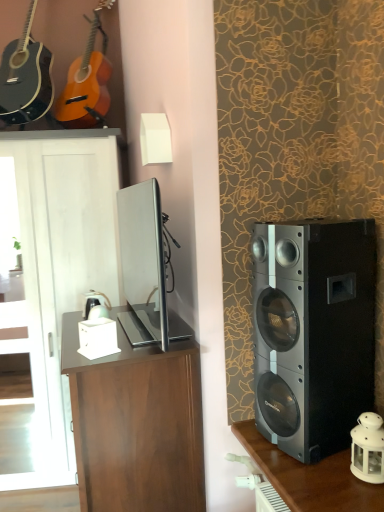
Describe the element at coordinates (145, 268) in the screenshot. The width and height of the screenshot is (384, 512). I see `satin silver tv at center` at that location.

The image size is (384, 512). What do you see at coordinates (136, 424) in the screenshot? I see `brown wood desk at center` at bounding box center [136, 424].

Consider the image. What is the approximate height of white glass lantern at lower right?

The height of white glass lantern at lower right is 8.22 inches.

Locate an element on the screen. dark wood shelf at right is located at coordinates (310, 477).

Can you confirm if white matte lampshade at upper center is positioned to the left of matte wood guitar at upper left, arranged as the first guitar when viewed from the right?

No, white matte lampshade at upper center is not to the left of matte wood guitar at upper left, arranged as the first guitar when viewed from the right.

In the scene shown: Which object is further away from the camera taking this photo, white matte lampshade at upper center or matte wood guitar at upper left, which appears as the 2th guitar when viewed from the left?

matte wood guitar at upper left, which appears as the 2th guitar when viewed from the left.

Consider the image. From the image's perspective, which one is positioned higher, satin silver tv at center or matte wood guitar at upper left, which appears as the 2th guitar when viewed from the left?

matte wood guitar at upper left, which appears as the 2th guitar when viewed from the left, appears higher in the image.

Based on the photo, between satin silver tv at center and matte wood guitar at upper left, arranged as the first guitar when viewed from the right, which one has smaller width?

satin silver tv at center is thinner.

What's the angular difference between satin silver tv at center and matte wood guitar at upper left, which appears as the 2th guitar when viewed from the left,'s facing directions?

The facing directions of satin silver tv at center and matte wood guitar at upper left, which appears as the 2th guitar when viewed from the left, are 79.6 degrees apart.

This screenshot has width=384, height=512. Find the location of `television below the matte wood guitar at upper left, arranged as the first guitar when viewed from the right (from the image's perspective)`. television below the matte wood guitar at upper left, arranged as the first guitar when viewed from the right (from the image's perspective) is located at coordinates (145, 268).

From the image's perspective, is brown wood desk at center over matte black acoustic guitar at upper left, the first guitar when ordered from left to right?

No, from the image's perspective, brown wood desk at center is not over matte black acoustic guitar at upper left, the first guitar when ordered from left to right.

Is brown wood desk at center not close to matte black acoustic guitar at upper left, the first guitar when ordered from left to right?

Yes, brown wood desk at center and matte black acoustic guitar at upper left, the first guitar when ordered from left to right, are located far from each other.

Is brown wood desk at center aimed at matte black acoustic guitar at upper left, the 2th guitar from the right?

No, brown wood desk at center does not turn towards matte black acoustic guitar at upper left, the 2th guitar from the right.

From a real-world perspective, is white matte lampshade at upper center beneath brown wood desk at center?

No, from a real-world perspective, white matte lampshade at upper center is not beneath brown wood desk at center.

Is white matte lampshade at upper center taller than brown wood desk at center?

No.

Image resolution: width=384 pixels, height=512 pixels. In order to click on desk in front of the white matte lampshade at upper center in this screenshot , I will do `click(136, 424)`.

From a real-world perspective, is white matte lampshade at upper center over matte black acoustic guitar at upper left, the first guitar when ordered from left to right?

No, from a real-world perspective, white matte lampshade at upper center is not above matte black acoustic guitar at upper left, the first guitar when ordered from left to right.

Would you say white matte lampshade at upper center is to the left or to the right of matte black acoustic guitar at upper left, the 2th guitar from the right, in the picture?

Clearly, white matte lampshade at upper center is on the right of matte black acoustic guitar at upper left, the 2th guitar from the right, in the image.

Is white matte lampshade at upper center facing away from matte black acoustic guitar at upper left, the first guitar when ordered from left to right?

No, matte black acoustic guitar at upper left, the first guitar when ordered from left to right, is not at the back of white matte lampshade at upper center.

Is white matte lampshade at upper center spatially inside matte black acoustic guitar at upper left, the first guitar when ordered from left to right, or outside of it?

white matte lampshade at upper center is outside matte black acoustic guitar at upper left, the first guitar when ordered from left to right.

Does point (269, 470) appear closer or farther from the camera than point (303, 297)?

Point (269, 470) appears to be farther away from the viewer than point (303, 297).

Can we say dark wood shelf at right lies outside black metallic speaker at right?

Yes, dark wood shelf at right is located beyond the bounds of black metallic speaker at right.

From the image's perspective, which object appears higher, dark wood shelf at right or black metallic speaker at right?

black metallic speaker at right appears higher in the image.

From a real-world perspective, is white glass lantern at lower right located beneath satin silver tv at center?

Correct, in the physical world, white glass lantern at lower right is lower than satin silver tv at center.

Is white glass lantern at lower right facing away from satin silver tv at center?

No.

This screenshot has width=384, height=512. What are the coordinates of `television behind the white glass lantern at lower right` in the screenshot? It's located at (145, 268).

Starting from the white matte lampshade at upper center, which guitar is the 1st one to the left? Please provide its 2D coordinates.

[(87, 81)]

You are a GUI agent. You are given a task and a screenshot of the screen. Output one action in this format:
    pyautogui.click(x=<x>, y=<y>)
    Task: Click on the guitar that is the 2nd object above the satin silver tv at center (from a real-world perspective)
    The height and width of the screenshot is (512, 384).
    Given the screenshot: What is the action you would take?
    pyautogui.click(x=87, y=81)

Looking at the image, which one is located further to satin silver tv at center, brown wood desk at center or white glass lantern at lower right?

The object further to satin silver tv at center is white glass lantern at lower right.

When comparing their distances from white glass lantern at lower right, does dark wood shelf at right or matte black acoustic guitar at upper left, the first guitar when ordered from left to right, seem closer?

dark wood shelf at right is closer to white glass lantern at lower right.

From the image, which object appears to be farther from matte wood guitar at upper left, which appears as the 2th guitar when viewed from the left, satin silver tv at center or black metallic speaker at right?

black metallic speaker at right is positioned further to the anchor matte wood guitar at upper left, which appears as the 2th guitar when viewed from the left.

Which object lies further to the anchor point black metallic speaker at right, matte black acoustic guitar at upper left, the first guitar when ordered from left to right, or white glass lantern at lower right?

matte black acoustic guitar at upper left, the first guitar when ordered from left to right.

Based on their spatial positions, is white matte lampshade at upper center or black metallic speaker at right closer to satin silver tv at center?

Among the two, white matte lampshade at upper center is located nearer to satin silver tv at center.

Looking at the image, which one is located closer to black metallic speaker at right, white glass lantern at lower right or satin silver tv at center?

Based on the image, white glass lantern at lower right appears to be nearer to black metallic speaker at right.

From the image, which object appears to be nearer to brown wood cabinet at left, black metallic speaker at right or matte wood guitar at upper left, arranged as the first guitar when viewed from the right?

matte wood guitar at upper left, arranged as the first guitar when viewed from the right, is positioned closer to the anchor brown wood cabinet at left.

From the image, which object appears to be farther from brown wood cabinet at left, brown wood desk at center or white glass lantern at lower right?

white glass lantern at lower right is positioned further to the anchor brown wood cabinet at left.

What are the coordinates of `table between satin silver tv at center and brown wood desk at center in the vertical direction` in the screenshot? It's located at (310, 477).

Where is `table between matte wood guitar at upper left, which appears as the 2th guitar when viewed from the left, and brown wood desk at center vertically`? The height and width of the screenshot is (512, 384). table between matte wood guitar at upper left, which appears as the 2th guitar when viewed from the left, and brown wood desk at center vertically is located at coordinates (310, 477).

Locate an element on the screen. The height and width of the screenshot is (512, 384). loudspeaker between matte black acoustic guitar at upper left, the first guitar when ordered from left to right, and dark wood shelf at right in the up-down direction is located at coordinates (313, 332).

The image size is (384, 512). In order to click on guitar between matte wood guitar at upper left, arranged as the first guitar when viewed from the right, and satin silver tv at center, in the vertical direction in this screenshot , I will do `click(25, 77)`.